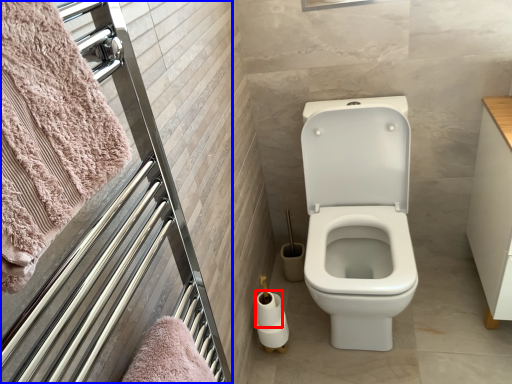
Question: Among these objects, which one is farthest to the camera, toilet paper (highlighted by a red box) or screen door (highlighted by a blue box)?

Choices:
 (A) toilet paper
 (B) screen door

Answer: (A)